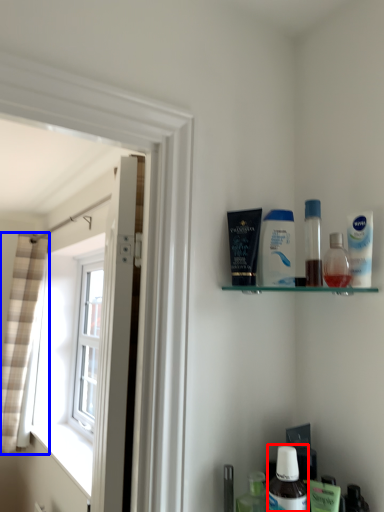
Question: Which of the following is the farthest to the observer, mouthwash (highlighted by a red box) or curtain (highlighted by a blue box)?

Choices:
 (A) mouthwash
 (B) curtain

Answer: (B)